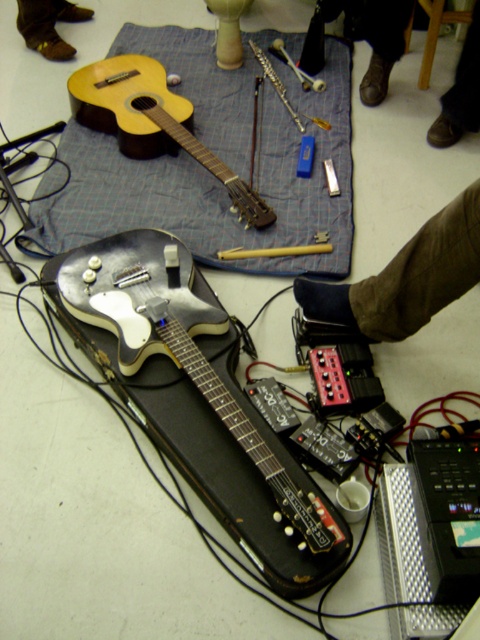
Question: From the image, what is the correct spatial relationship of metallic silver electric guitar at center in relation to brown leather shoes at lower left?

Choices:
 (A) below
 (B) above

Answer: (A)

Question: Which object is farther from the camera taking this photo?

Choices:
 (A) brown leather shoe at lower right
 (B) metallic silver electric guitar at center
 (C) brown leather shoes at lower left
 (D) blue fabric guitar at center

Answer: (C)

Question: Can you confirm if matte wood guitar at upper left is wider than brown leather shoe at lower right?

Choices:
 (A) yes
 (B) no

Answer: (A)

Question: Which point is closer to the camera?

Choices:
 (A) blue fabric guitar at center
 (B) matte wood guitar at upper left
 (C) brown leather shoes at lower left

Answer: (A)

Question: Can you confirm if matte wood guitar at upper left is wider than brown leather shoes at lower left?

Choices:
 (A) no
 (B) yes

Answer: (B)

Question: Which point is closer to the camera taking this photo?

Choices:
 (A) (156, 240)
 (B) (474, 129)
 (C) (119, 92)

Answer: (A)